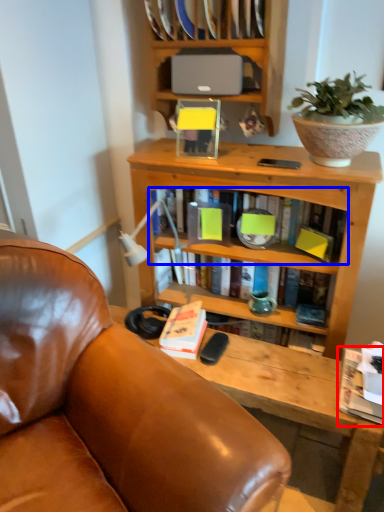
Question: Among these objects, which one is nearest to the camera, book (highlighted by a red box) or book (highlighted by a blue box)?

Choices:
 (A) book
 (B) book

Answer: (A)